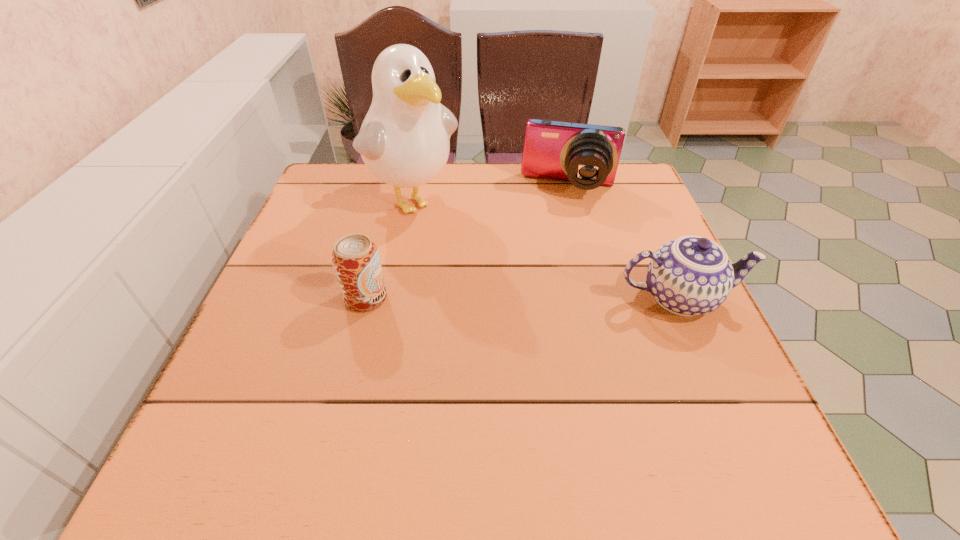
The image size is (960, 540). In order to click on free space on the desktop that is between the beer can and the chinaware and is positioned on the beak of the gull in this screenshot , I will do `click(514, 298)`.

At what (x,y) coordinates should I click in order to perform the action: click on free space on the desktop that is between the beer can and the chinaware and is positioned on the front-facing side of the camera. Please return your answer as a coordinate pair (x, y). The height and width of the screenshot is (540, 960). Looking at the image, I should click on (552, 298).